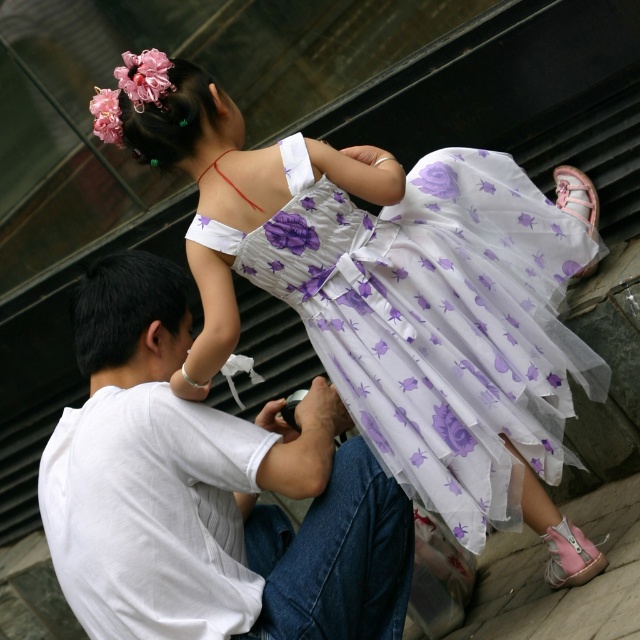
Question: Which object appears farthest from the camera in this image?

Choices:
 (A) white cotton shirt at center
 (B) translucent floral dress at upper center

Answer: (B)

Question: Does translucent floral dress at upper center come in front of white cotton shirt at center?

Choices:
 (A) yes
 (B) no

Answer: (B)

Question: Can you confirm if translucent floral dress at upper center is positioned below white cotton shirt at center?

Choices:
 (A) no
 (B) yes

Answer: (A)

Question: Which point is closer to the camera?

Choices:
 (A) translucent floral dress at upper center
 (B) white cotton shirt at center

Answer: (B)

Question: In this image, where is translucent floral dress at upper center located relative to white cotton shirt at center?

Choices:
 (A) left
 (B) right

Answer: (B)